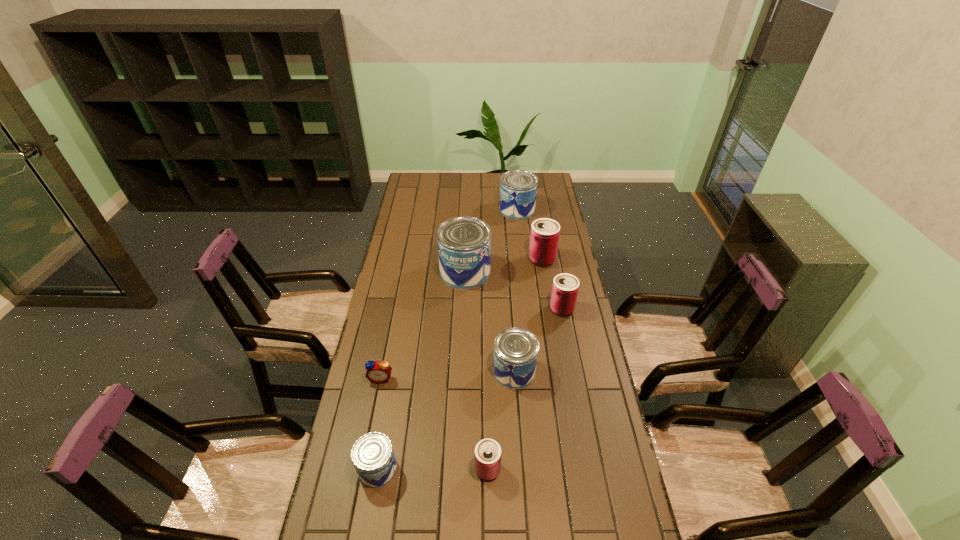
Where is `the tallest object`? the tallest object is located at coordinates (464, 243).

You are a GUI agent. You are given a task and a screenshot of the screen. Output one action in this format:
    pyautogui.click(x=<x>, y=<y>)
    Task: Click on the second blue can from left to right
    The width and height of the screenshot is (960, 540).
    Given the screenshot: What is the action you would take?
    pyautogui.click(x=464, y=243)

At what (x,y) coordinates should I click in order to perform the action: click on the biggest pink can. Please return your answer as a coordinate pair (x, y). Looking at the image, I should click on (544, 237).

Where is `the farthest object`? The image size is (960, 540). the farthest object is located at coordinates (518, 188).

Identify the location of the farthest can. (518, 188).

Identify the location of the fourth farthest object. (565, 287).

Find the location of `the second smallest pink can`. the second smallest pink can is located at coordinates (565, 287).

Find the location of `the second nearest blue can`. the second nearest blue can is located at coordinates (515, 355).

This screenshot has width=960, height=540. I want to click on the third nearest can, so click(x=515, y=355).

Locate an element on the screen. The height and width of the screenshot is (540, 960). red alarm clock is located at coordinates (379, 372).